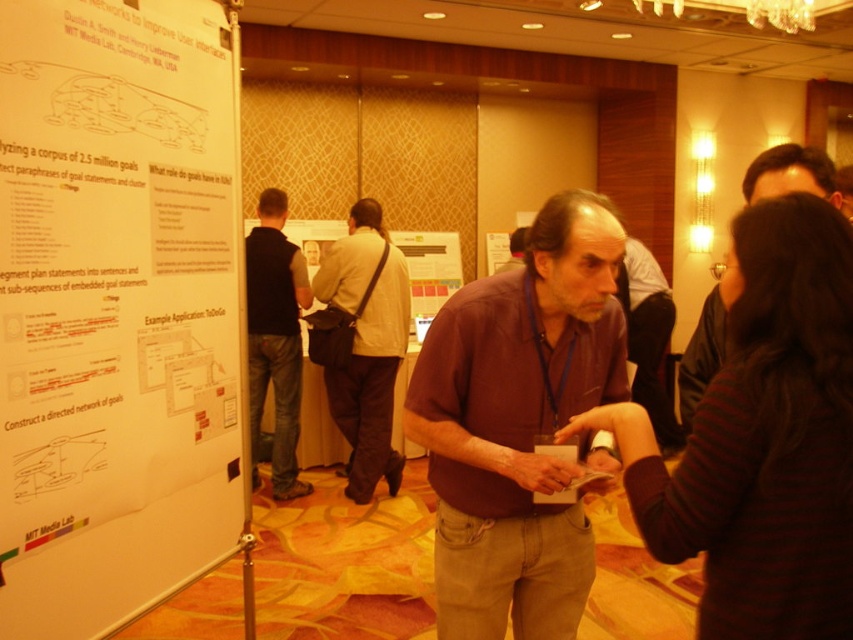
Question: Can you confirm if dark gray vest at center is wider than dark brown leather jacket at center?

Choices:
 (A) yes
 (B) no

Answer: (B)

Question: Is white paper at left below maroon cotton shirt at center?

Choices:
 (A) yes
 (B) no

Answer: (B)

Question: Does striped sweater at center appear under dark brown leather jacket at center?

Choices:
 (A) yes
 (B) no

Answer: (A)

Question: Based on their relative distances, which object is nearer to the striped sweater at center?

Choices:
 (A) light brown leather jacket at center
 (B) white paper at left
 (C) dark gray vest at center
 (D) dark brown leather jacket at center

Answer: (D)

Question: Which object is positioned closest to the maroon cotton shirt at center?

Choices:
 (A) light brown leather jacket at center
 (B) striped sweater at center
 (C) white paper at left
 (D) dark brown leather jacket at center

Answer: (B)

Question: Which object is closer to the camera taking this photo?

Choices:
 (A) light brown leather jacket at center
 (B) maroon cotton shirt at center

Answer: (B)